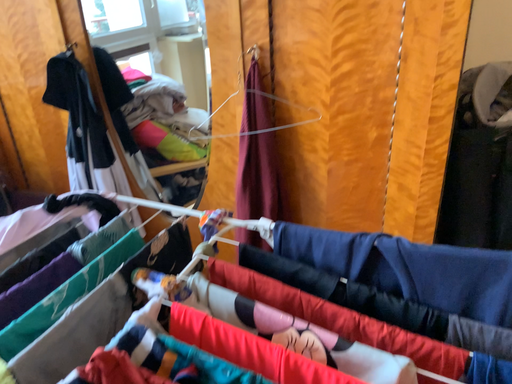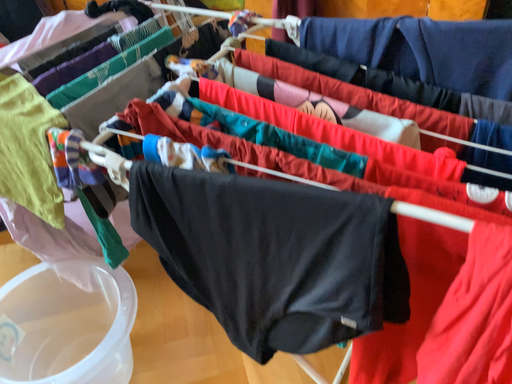
Question: How did the camera likely rotate when shooting the video?

Choices:
 (A) rotated left
 (B) rotated right

Answer: (A)